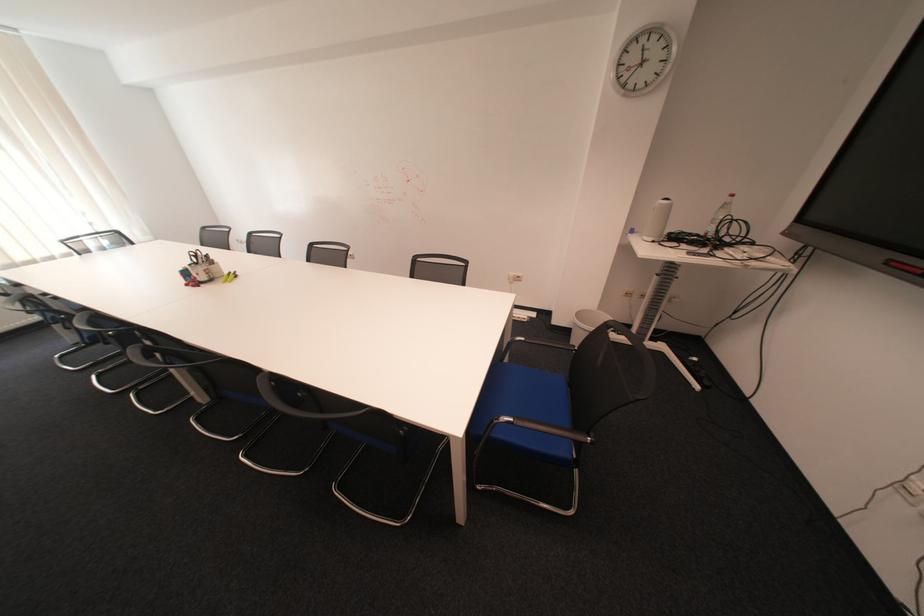
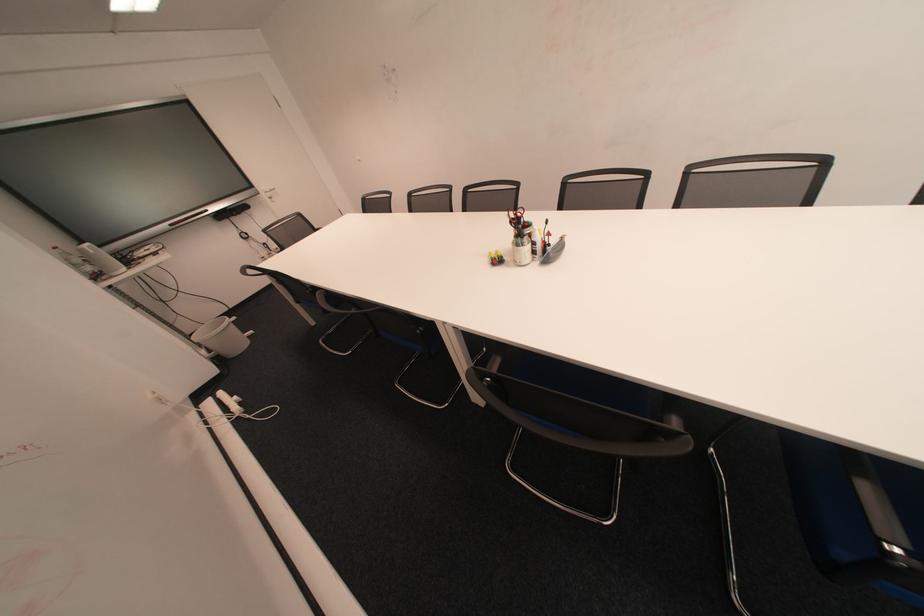
Question: I am providing you with two images of the same scene from different viewpoints. Which of the following objects are not visible in image2?

Choices:
 (A) small gray pouch
 (B) black chair armrest
 (C) black reading lamp
 (D) white pen holder

Answer: (B)